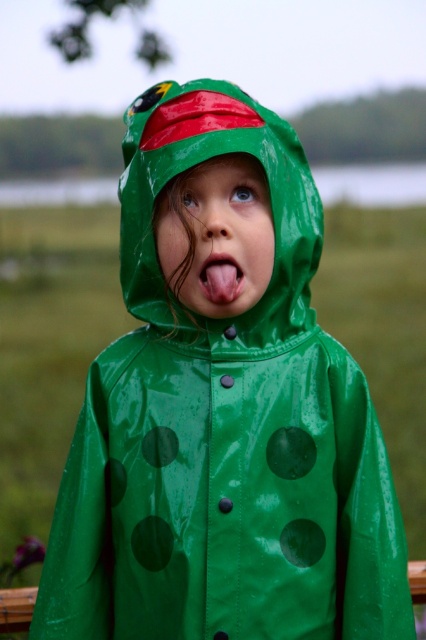
Question: Does green rubber raincoat at center appear on the left side of pink flesh at center?

Choices:
 (A) yes
 (B) no

Answer: (A)

Question: Is green rubber raincoat at center positioned before pink flesh at center?

Choices:
 (A) no
 (B) yes

Answer: (B)

Question: Among these points, which one is nearest to the camera?

Choices:
 (A) (241, 99)
 (B) (215, 298)

Answer: (B)

Question: Is green rubber raincoat at center further to the viewer compared to pink flesh at center?

Choices:
 (A) yes
 (B) no

Answer: (B)